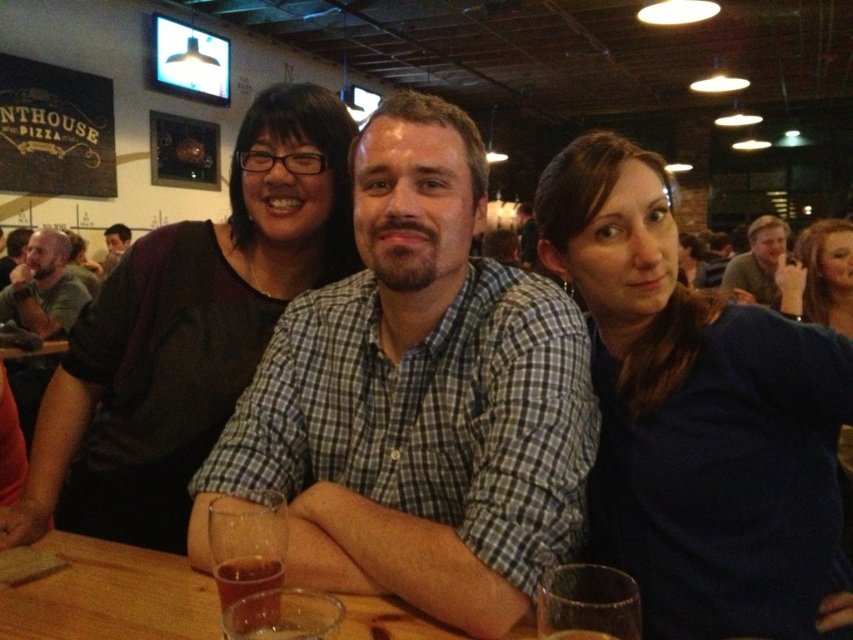
Question: Does checkered fabric shirt at center have a larger size compared to green shirt at upper right?

Choices:
 (A) yes
 (B) no

Answer: (B)

Question: In this image, where is blue matte shirt at center located relative to matte black shirt at center?

Choices:
 (A) above
 (B) below

Answer: (B)

Question: Estimate the real-world distances between objects in this image. Which object is farther from the matte black shirt at left?

Choices:
 (A) matte black shirt at center
 (B) wooden table at center

Answer: (B)

Question: Which is farther from the green shirt at upper right?

Choices:
 (A) matte black shirt at left
 (B) matte black shirt at center
 (C) wooden table at center

Answer: (A)

Question: Is checkered fabric shirt at center above wooden table at center?

Choices:
 (A) yes
 (B) no

Answer: (A)

Question: Which of the following is the farthest from the observer?

Choices:
 (A) wooden table at center
 (B) matte black shirt at left

Answer: (B)